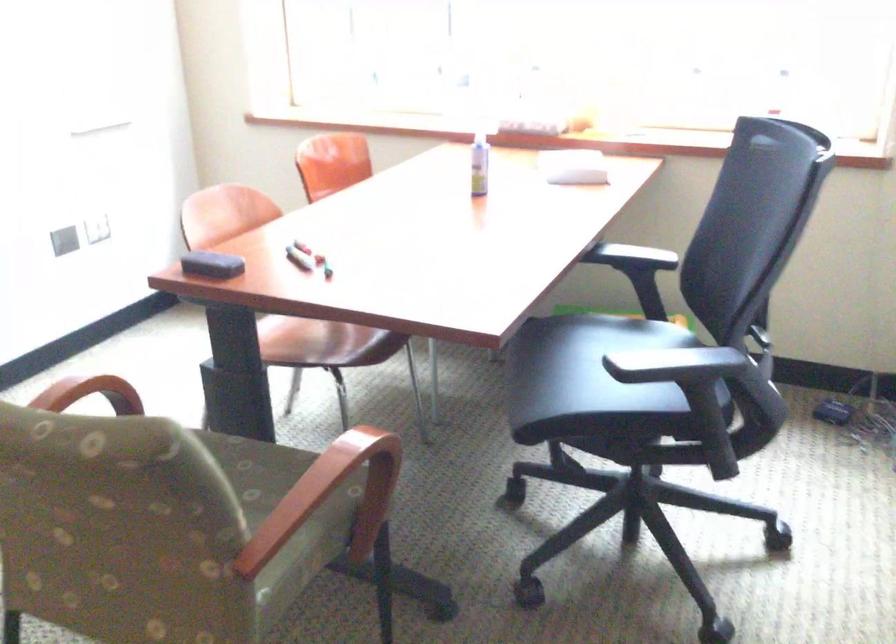
What do you see at coordinates (295, 336) in the screenshot? This screenshot has width=896, height=644. I see `the orange chair sitting surface` at bounding box center [295, 336].